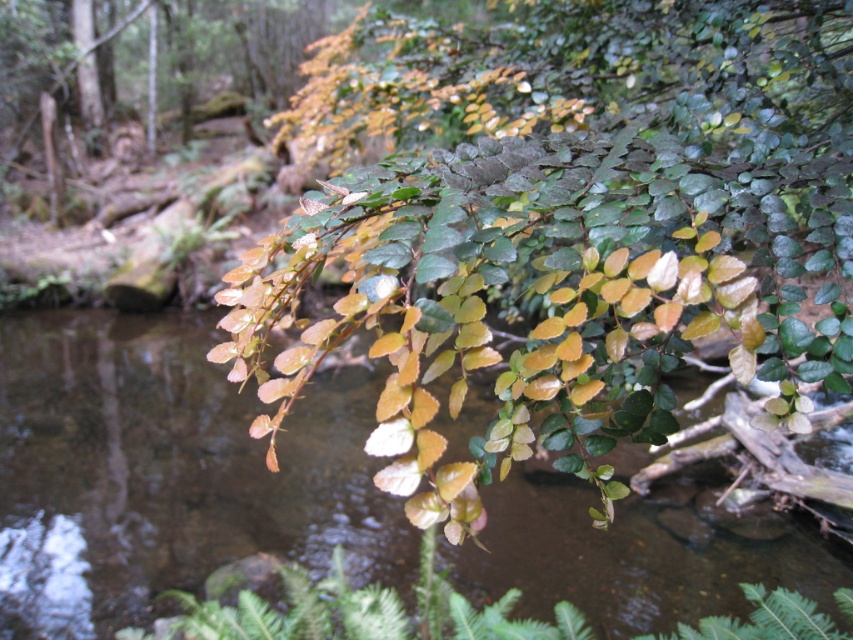
You are an observer standing in the forest looking at the scene. Which object is positioned higher up between the green glossy leaves at upper center and the green leafy branch at center?

The green glossy leaves at upper center is positioned higher up than the green leafy branch at center.

Looking at this image, you are an artist sketching the scene and need to determine the vertical positioning of elements. Which object, the green glossy leaves at upper center or the green leafy branch at center, should you draw higher on your paper?

The green glossy leaves at upper center should be drawn higher since they have a greater height compared to the green leafy branch at center.